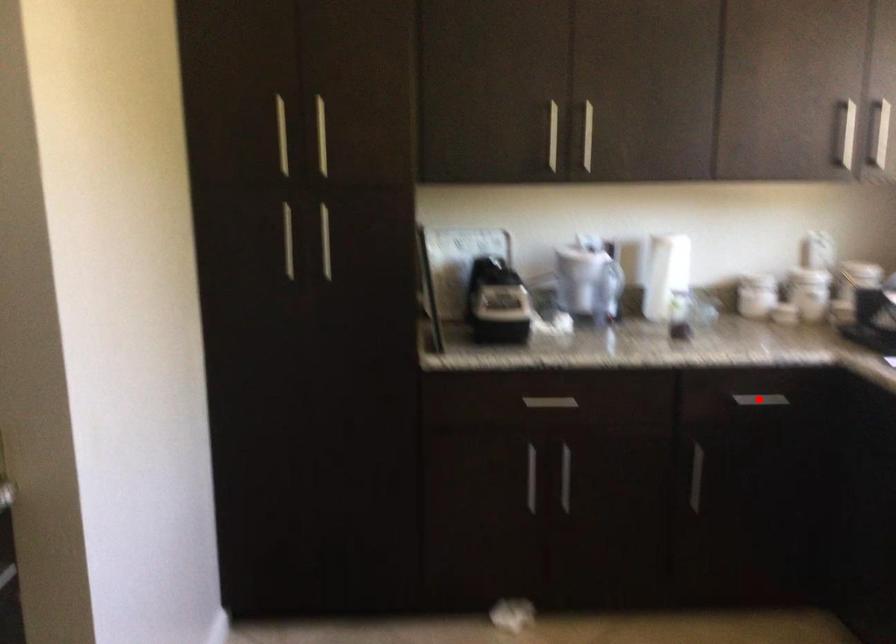
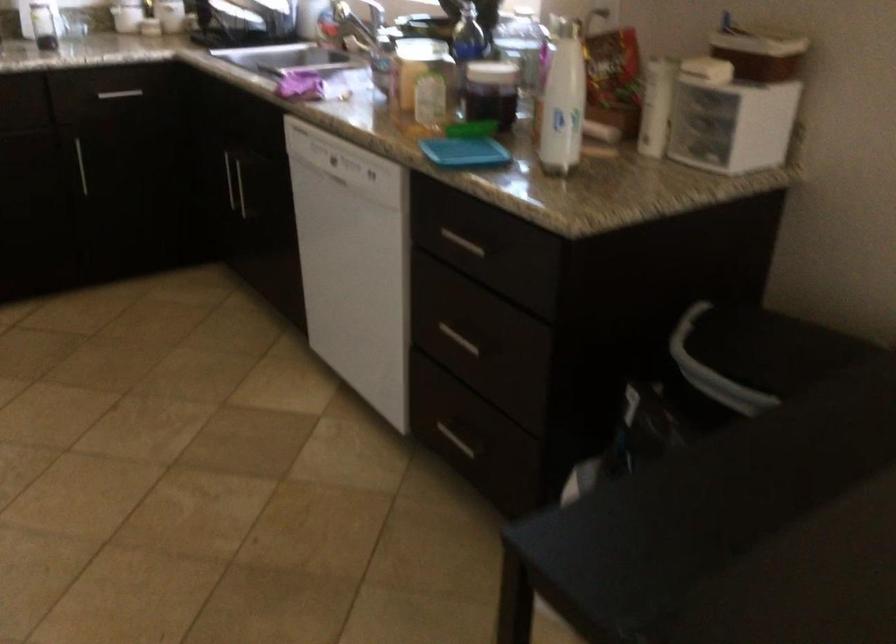
Question: I am providing you with two images of the same scene from different viewpoints. A red point is shown in image1. For the corresponding object point in image2, is it positioned nearer or farther from the camera?

Choices:
 (A) Nearer
 (B) Farther

Answer: (B)